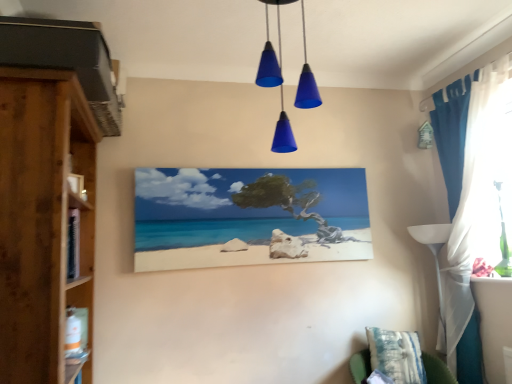
Question: Can you confirm if blue fabric curtain at right is bigger than wooden cupboard at left?

Choices:
 (A) no
 (B) yes

Answer: (A)

Question: Would you say blue fabric curtain at right is a long distance from wooden cupboard at left?

Choices:
 (A) no
 (B) yes

Answer: (B)

Question: Can you confirm if blue fabric curtain at right is taller than wooden cupboard at left?

Choices:
 (A) no
 (B) yes

Answer: (B)

Question: Is wooden cupboard at left located within blue fabric curtain at right?

Choices:
 (A) yes
 (B) no

Answer: (B)

Question: Can you confirm if blue fabric curtain at right is wider than wooden cupboard at left?

Choices:
 (A) no
 (B) yes

Answer: (A)

Question: Visually, is matte canvas painting at center positioned to the left or to the right of blue matte cone lights at center?

Choices:
 (A) right
 (B) left

Answer: (B)

Question: Looking at the image, does matte canvas painting at center seem bigger or smaller compared to blue matte cone lights at center?

Choices:
 (A) small
 (B) big

Answer: (A)

Question: In the image, is matte canvas painting at center positioned in front of or behind blue matte cone lights at center?

Choices:
 (A) behind
 (B) front

Answer: (A)

Question: Is matte canvas painting at center situated inside blue matte cone lights at center or outside?

Choices:
 (A) inside
 (B) outside

Answer: (B)

Question: Considering the positions of wooden cupboard at left and blue matte cone lights at center in the image, is wooden cupboard at left wider or thinner than blue matte cone lights at center?

Choices:
 (A) thin
 (B) wide

Answer: (B)

Question: Relative to blue matte cone lights at center, is wooden cupboard at left in front or behind?

Choices:
 (A) front
 (B) behind

Answer: (A)

Question: Would you say wooden cupboard at left is to the left or to the right of blue matte cone lights at center in the picture?

Choices:
 (A) right
 (B) left

Answer: (B)

Question: In terms of height, does wooden cupboard at left look taller or shorter compared to blue matte cone lights at center?

Choices:
 (A) short
 (B) tall

Answer: (B)

Question: Considering the positions of wooden cupboard at left and matte canvas painting at center in the image, is wooden cupboard at left taller or shorter than matte canvas painting at center?

Choices:
 (A) short
 (B) tall

Answer: (B)

Question: In the image, is wooden cupboard at left positioned in front of or behind matte canvas painting at center?

Choices:
 (A) front
 (B) behind

Answer: (A)